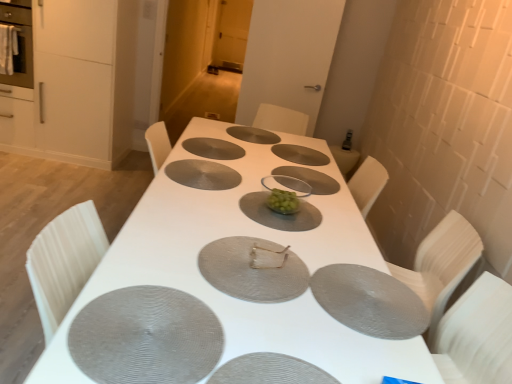
Image resolution: width=512 pixels, height=384 pixels. Identify the location of free location to the left of green matte platter at center. (205, 193).